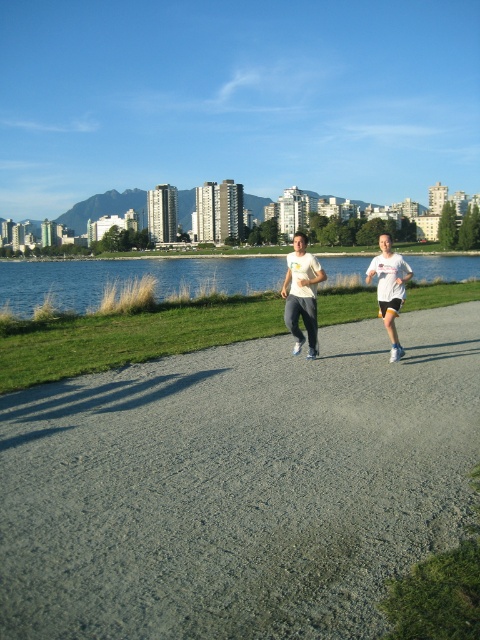
Is white cotton t-shirt at center smaller than white matte t-shirt at center?

Actually, white cotton t-shirt at center might be larger than white matte t-shirt at center.

Find the location of `white cotton t-shirt at center`. white cotton t-shirt at center is located at coordinates (301, 292).

Does gray asphalt path at center have a smaller size compared to white matte t-shirt at center?

No, gray asphalt path at center is not smaller than white matte t-shirt at center.

Between point (153, 401) and point (311, 348), which one is positioned behind?

Point (311, 348)

Measure the distance between point (345,484) and camera.

Point (345,484) is 17.11 feet from camera.

The height and width of the screenshot is (640, 480). I want to click on gray asphalt path at center, so click(238, 484).

Between gray asphalt path at center and white cotton t-shirt at center, which one has less height?

gray asphalt path at center is shorter.

Is point (113, 480) more distant than point (311, 336)?

That is False.

Find the location of `gray asphalt path at center`. gray asphalt path at center is located at coordinates (238, 484).